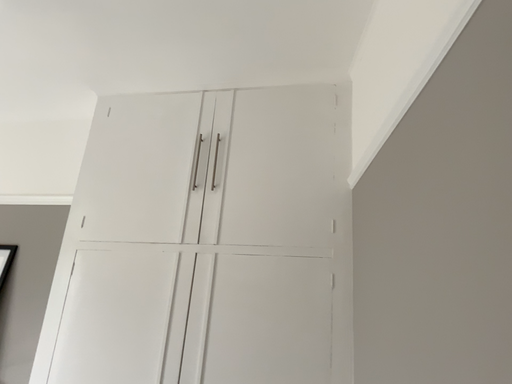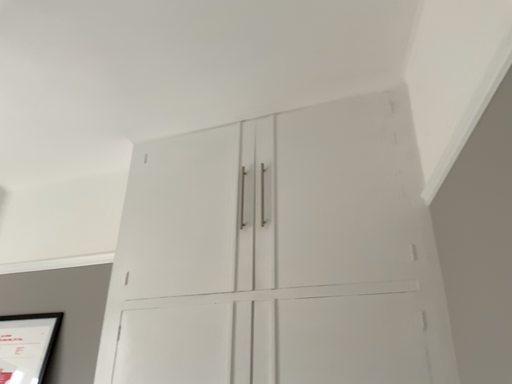
Question: How did the camera likely rotate when shooting the video?

Choices:
 (A) rotated left
 (B) rotated right

Answer: (A)